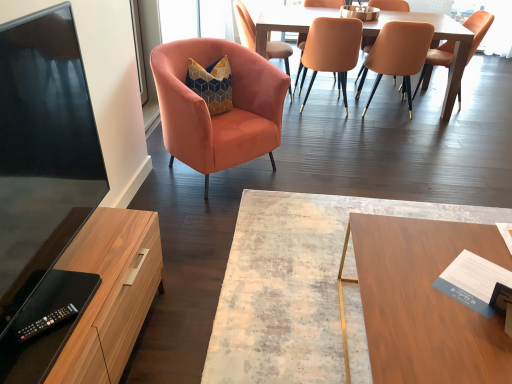
Find the location of a particular element. This screenshot has height=384, width=512. vacant space that's between matte orange chair at upper center, the 4th chair from the right, and wooden rectangular table at center is located at coordinates (359, 156).